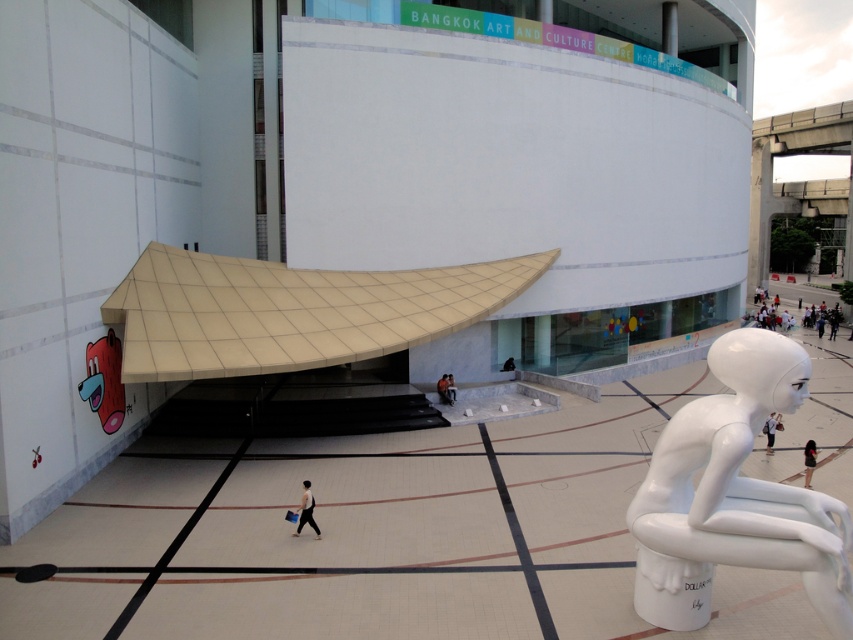
Between white glossy sculpture at right and light brown leather jacket at center, which one is positioned higher?

light brown leather jacket at center is higher up.

Who is positioned more to the right, white glossy sculpture at right or light brown leather jacket at center?

white glossy sculpture at right

I want to click on white glossy sculpture at right, so click(x=735, y=492).

Does beige tile canopy at center lie in front of white glossy sculpture at right?

No, it is not.

Measure the distance between point (427, 282) and camera.

A distance of 22.31 meters exists between point (427, 282) and camera.

At what (x,y) coordinates should I click in order to perform the action: click on beige tile canopy at center. Please return your answer as a coordinate pair (x, y). Looking at the image, I should click on (292, 310).

Is white glossy sculpture at right shorter than white glossy statue at center?

No.

In the scene shown: Does white glossy sculpture at right have a greater height compared to white glossy statue at center?

Yes.

Find the location of a particular element. This screenshot has height=640, width=853. white glossy sculpture at right is located at coordinates (735, 492).

At what (x,y) coordinates should I click in order to perform the action: click on white glossy sculpture at right. Please return your answer as a coordinate pair (x, y). The width and height of the screenshot is (853, 640). Looking at the image, I should click on (735, 492).